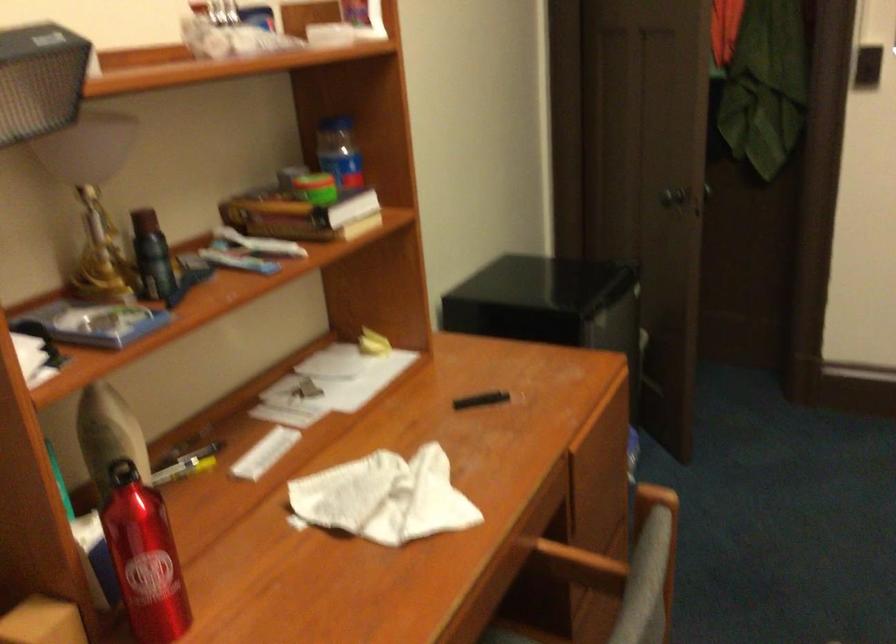
What do you see at coordinates (383, 498) in the screenshot? The width and height of the screenshot is (896, 644). I see `a crumpled paper napkin` at bounding box center [383, 498].